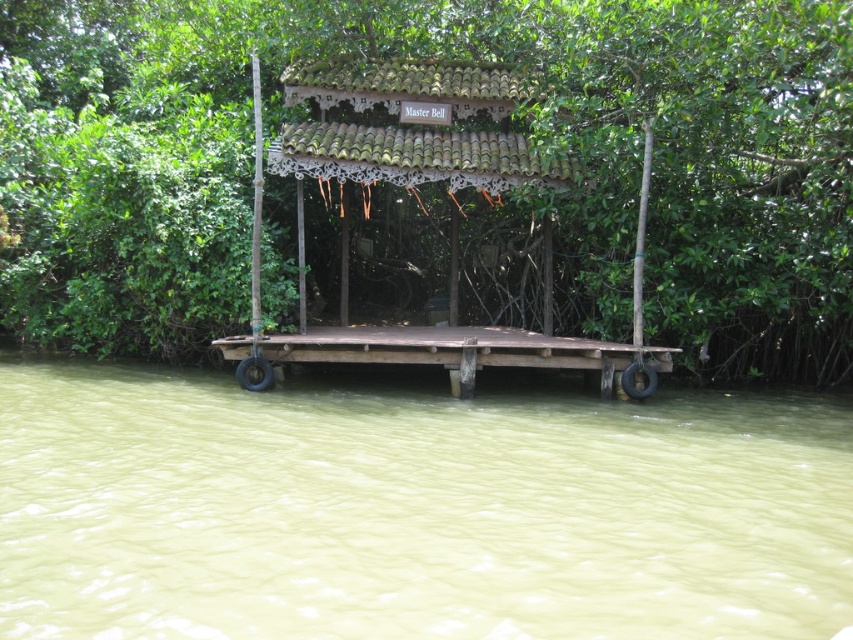
Question: Does brown wooden gazebo at center lie behind brown wooden dock at center?

Choices:
 (A) yes
 (B) no

Answer: (B)

Question: Can you confirm if brown wooden gazebo at center is positioned above brown wooden dock at center?

Choices:
 (A) yes
 (B) no

Answer: (A)

Question: Which point is closer to the camera?

Choices:
 (A) green leafy tree at center
 (B) brown wooden gazebo at center
 (C) brown wooden dock at center
 (D) green murky water at lower center

Answer: (D)

Question: Based on their relative distances, which object is nearer to the green murky water at lower center?

Choices:
 (A) green leafy tree at center
 (B) brown wooden gazebo at center
 (C) brown wooden dock at center

Answer: (B)

Question: Does green murky water at lower center appear on the left side of brown wooden gazebo at center?

Choices:
 (A) no
 (B) yes

Answer: (A)

Question: Which point is closer to the camera taking this photo?

Choices:
 (A) (375, 353)
 (B) (601, 362)

Answer: (A)